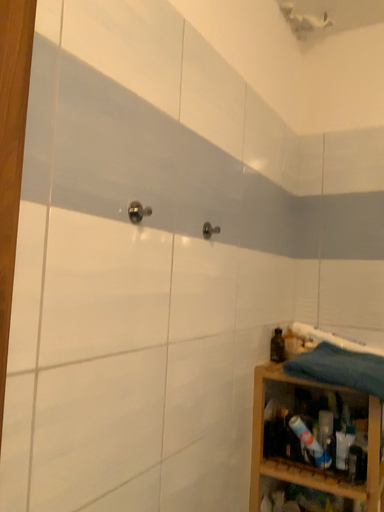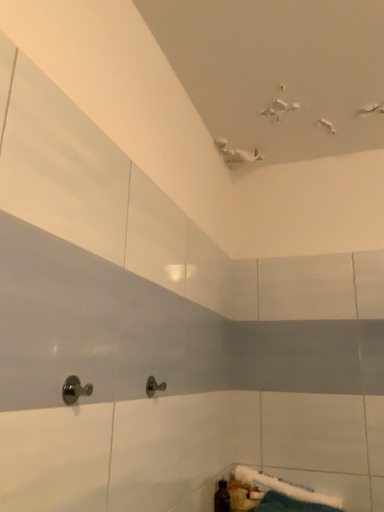
Question: How did the camera likely rotate when shooting the video?

Choices:
 (A) rotated downward
 (B) rotated upward

Answer: (B)